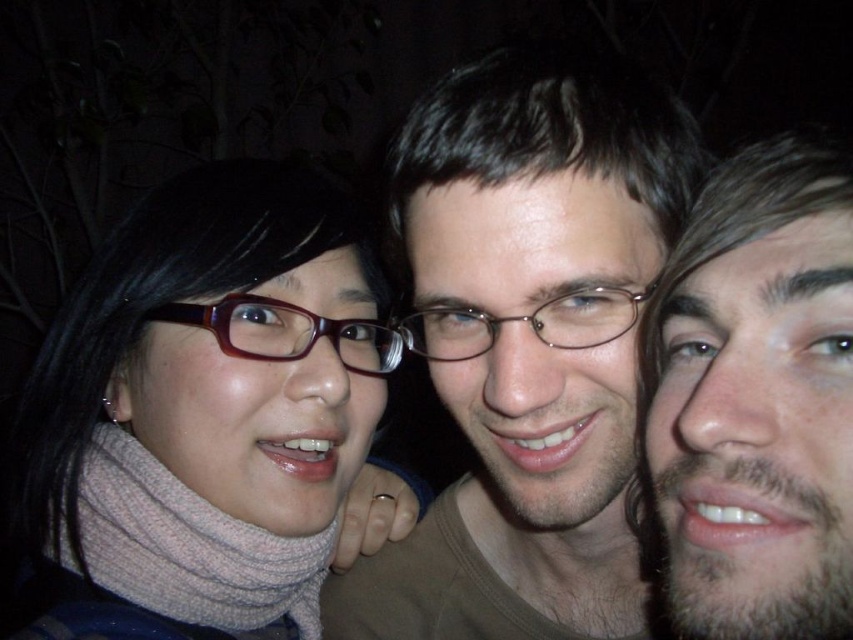
The height and width of the screenshot is (640, 853). What do you see at coordinates (209, 416) in the screenshot?
I see `matte brown hair at left` at bounding box center [209, 416].

Does point (41, 387) come closer to viewer compared to point (335, 344)?

No, (41, 387) is further to viewer.

Which is in front, point (335, 372) or point (312, 330)?

Point (335, 372)

This screenshot has width=853, height=640. I want to click on matte brown hair at left, so click(x=209, y=416).

The height and width of the screenshot is (640, 853). Describe the element at coordinates (209, 416) in the screenshot. I see `matte brown hair at left` at that location.

Find the location of `matte brown hair at left`. matte brown hair at left is located at coordinates (209, 416).

Describe the element at coordinates (209, 416) in the screenshot. I see `matte brown hair at left` at that location.

Find the location of a particular element. matte brown hair at left is located at coordinates tap(209, 416).

Can you confirm if matte brown hair at center is smaller than matte brown glasses at left?

No, matte brown hair at center is not smaller than matte brown glasses at left.

I want to click on matte brown hair at center, so click(527, 344).

Where is `matte brown hair at center`? This screenshot has width=853, height=640. matte brown hair at center is located at coordinates (527, 344).